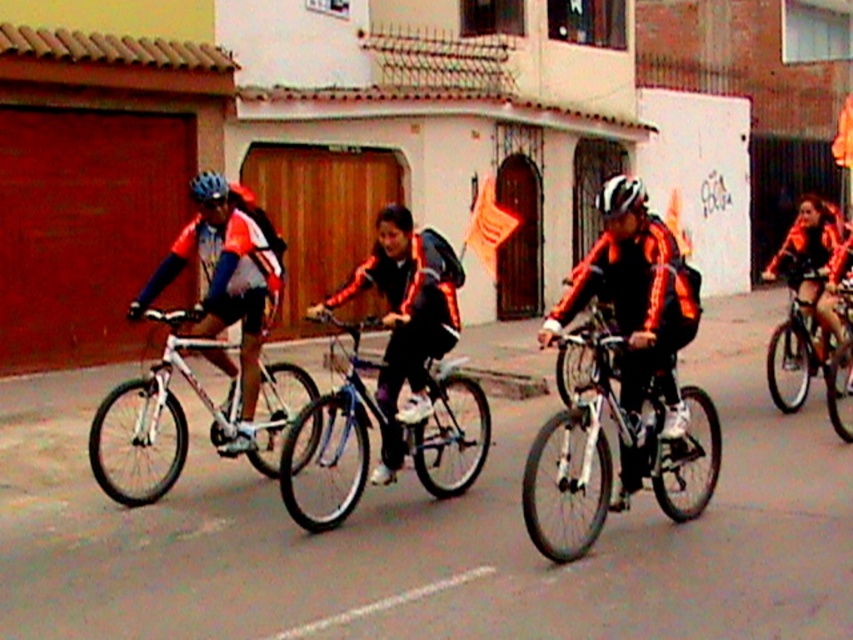
Question: Considering the relative positions of matte blue helmet at left and blue matte bicycle helmet at upper left in the image provided, where is matte blue helmet at left located with respect to blue matte bicycle helmet at upper left?

Choices:
 (A) below
 (B) above

Answer: (A)

Question: Which of these objects is positioned farthest from the shiny metallic bicycle at right?

Choices:
 (A) white matte bicycle helmet at center
 (B) silver metallic bicycle at center
 (C) orange reflective jacket at right
 (D) white metallic bicycle at left

Answer: (D)

Question: Is white metallic bicycle at left thinner than blue matte bicycle helmet at upper left?

Choices:
 (A) no
 (B) yes

Answer: (A)

Question: Which point is farther from the camera taking this photo?

Choices:
 (A) (579, 483)
 (B) (444, 292)

Answer: (B)

Question: Can you confirm if white metallic bicycle at left is smaller than orange reflective jacket at right?

Choices:
 (A) yes
 (B) no

Answer: (A)

Question: Among these points, which one is farthest from the camera?

Choices:
 (A) (657, 458)
 (B) (196, 193)

Answer: (B)